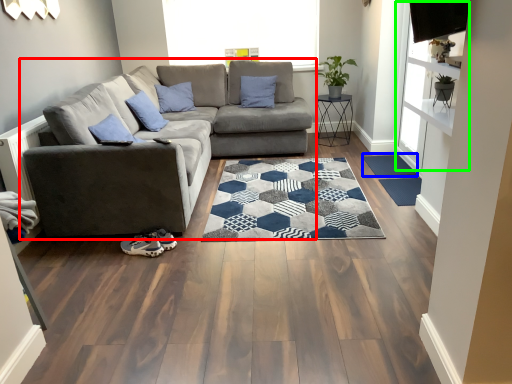
Question: Which object is positioned farthest from studio couch (highlighted by a red box)? Select from doormat (highlighted by a blue box) and window screen (highlighted by a green box).

Choices:
 (A) doormat
 (B) window screen

Answer: (B)